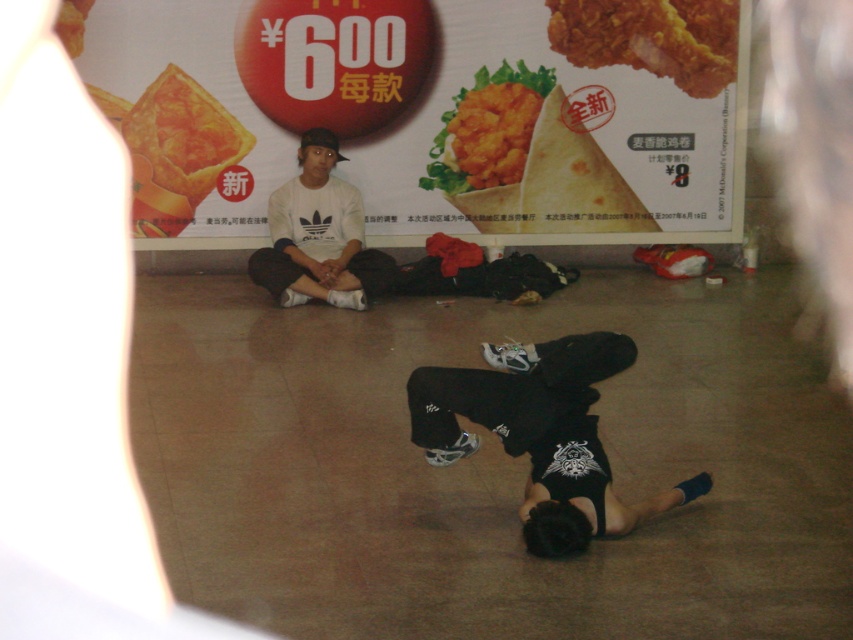
Is point (305, 273) closer to viewer compared to point (581, 44)?

Yes, it is.

Is white matte shirt at center taller than golden crispy chicken at upper right?

Indeed, white matte shirt at center has a greater height compared to golden crispy chicken at upper right.

Identify the location of white matte shirt at center. (318, 236).

Who is higher up, golden crispy chicken at upper right or golden crispy chicken at center?

golden crispy chicken at upper right is above.

Find the location of `golden crispy chicken at upper right`. golden crispy chicken at upper right is located at coordinates (651, 36).

The height and width of the screenshot is (640, 853). Find the location of `golden crispy chicken at upper right`. golden crispy chicken at upper right is located at coordinates (651, 36).

Does point (511, 346) come farther from viewer compared to point (325, 292)?

That is False.

Is black matte/soft squat at lower center bigger than white matte shirt at center?

Result: Indeed, black matte/soft squat at lower center has a larger size compared to white matte shirt at center.

The image size is (853, 640). Identify the location of black matte/soft squat at lower center. (541, 433).

Image resolution: width=853 pixels, height=640 pixels. Find the location of `black matte/soft squat at lower center`. black matte/soft squat at lower center is located at coordinates (541, 433).